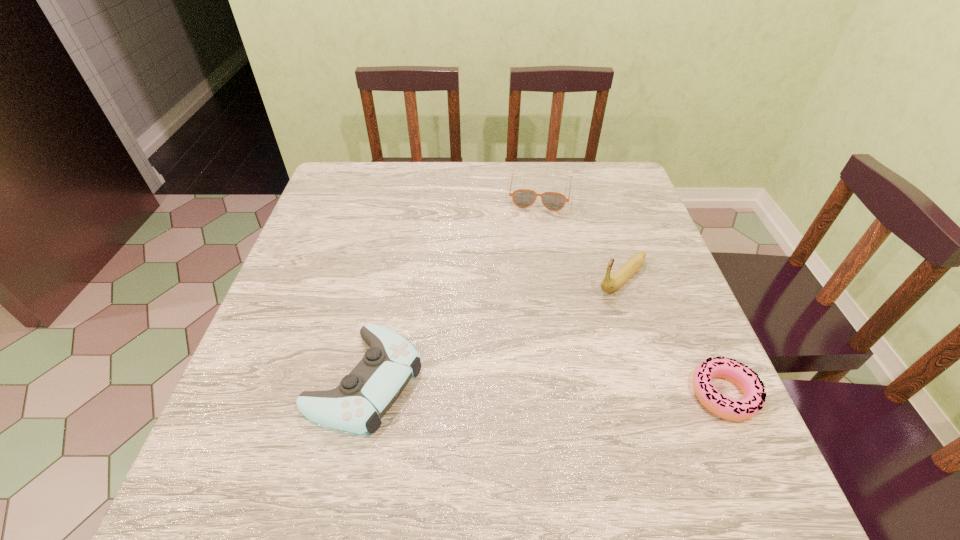
The height and width of the screenshot is (540, 960). Identify the location of free space that satisfies the following two spatial constraints: 1. on the front side of the control; 2. on the left side of the doughnut. (362, 394).